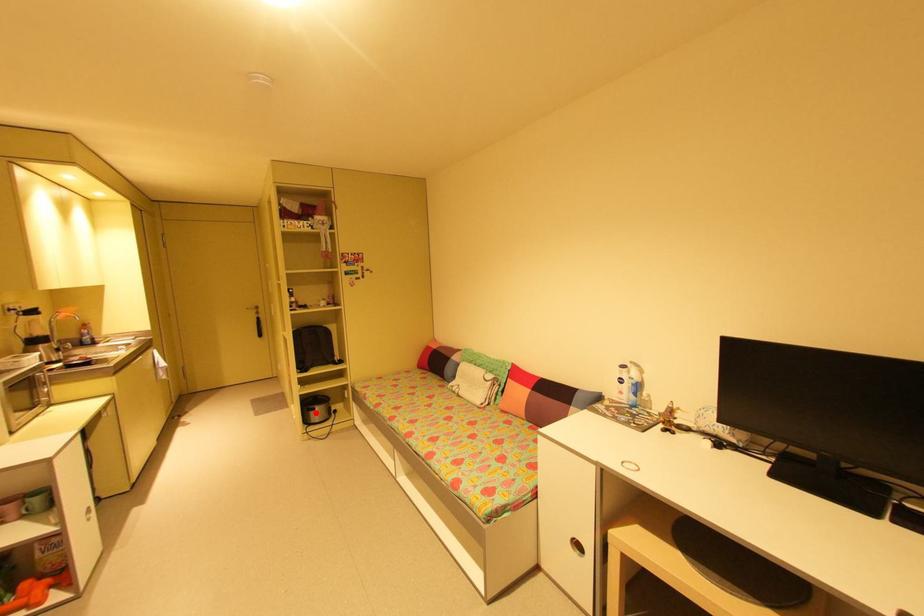
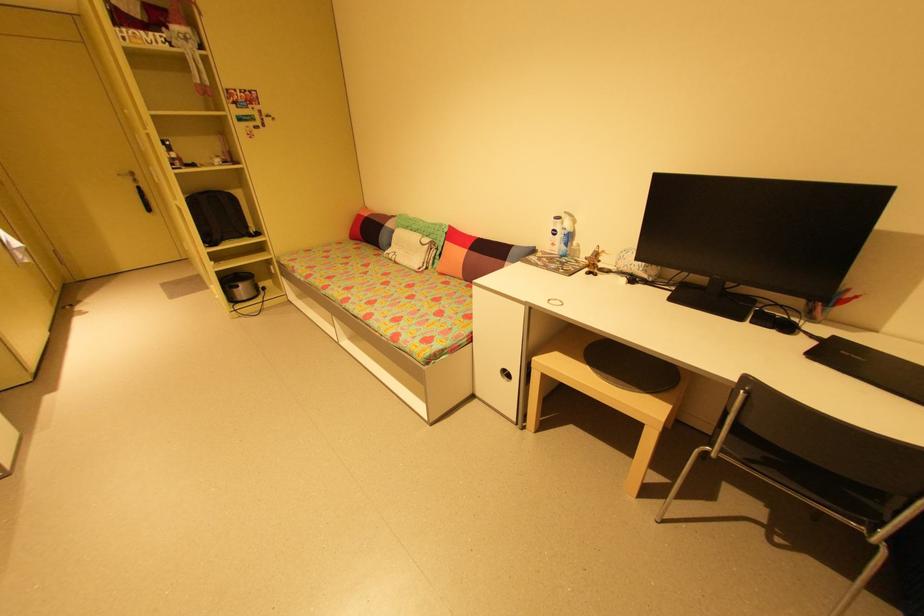
Question: I am providing you with two images of the same scene from different viewpoints. Given a red point in image1, look at the same physical point in image2. Is it:

Choices:
 (A) Closer to the viewpoint
 (B) Farther from the viewpoint

Answer: (A)